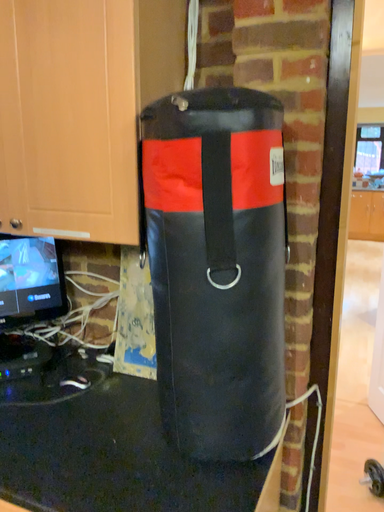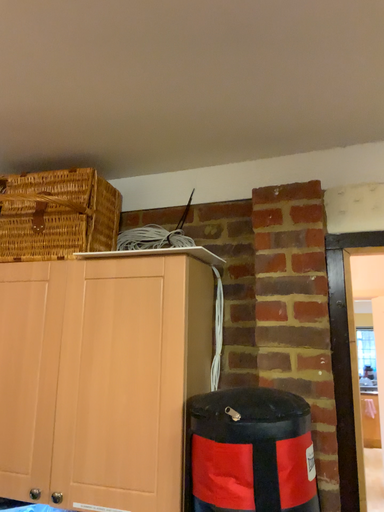
Question: Which way did the camera rotate in the video?

Choices:
 (A) rotated upward
 (B) rotated downward

Answer: (A)